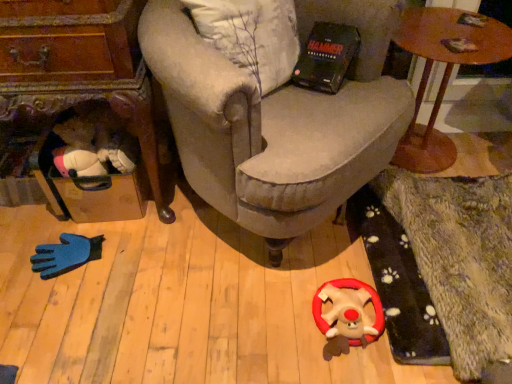
Question: Considering the positions of wooden suitcase at left, marked as the 2th table in a right-to-left arrangement, and velvet beige armchair at center in the image, is wooden suitcase at left, marked as the 2th table in a right-to-left arrangement, wider or thinner than velvet beige armchair at center?

Choices:
 (A) wide
 (B) thin

Answer: (B)

Question: Relative to velvet beige armchair at center, is wooden suitcase at left, marked as the 2th table in a right-to-left arrangement, in front or behind?

Choices:
 (A) behind
 (B) front

Answer: (A)

Question: Which object is the farthest from the wooden suitcase at left, arranged as the 1th table when viewed from the left?

Choices:
 (A) fluffy plush toy at center
 (B) velvet beige armchair at center
 (C) wooden round table at upper right, which is counted as the 2th table, starting from the left

Answer: (C)

Question: Based on their relative distances, which object is nearer to the velvet beige armchair at center?

Choices:
 (A) fluffy plush toy at center
 (B) wooden suitcase at left, arranged as the 1th table when viewed from the left
 (C) wooden round table at upper right, which is counted as the 2th table, starting from the left

Answer: (B)